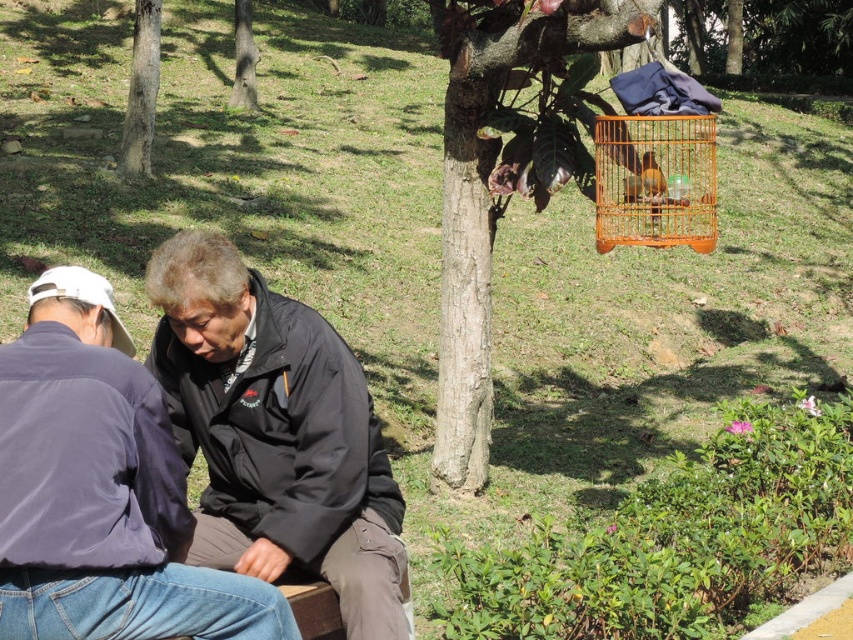
Question: Can you confirm if brown wood tree at upper center is positioned above orange wire birdcage at upper right?

Choices:
 (A) no
 (B) yes

Answer: (B)

Question: In this image, where is brown wood tree at upper center located relative to brown rough tree trunk at upper center?

Choices:
 (A) right
 (B) left

Answer: (A)

Question: Considering the real-world distances, which object is closest to the dark blue jacket at lower left?

Choices:
 (A) black matte jacket at center
 (B) rough bark tree at upper left

Answer: (A)

Question: Which of the following is the farthest from the observer?

Choices:
 (A) rough bark tree at upper left
 (B) brown rough tree trunk at upper center
 (C) dark blue jacket at lower left
 (D) orange wire birdcage at upper right

Answer: (B)

Question: Does black matte jacket at center have a greater width compared to rough bark tree at upper left?

Choices:
 (A) yes
 (B) no

Answer: (A)

Question: Which of the following is the closest to the observer?

Choices:
 (A) black matte jacket at center
 (B) dark blue jacket at lower left

Answer: (B)